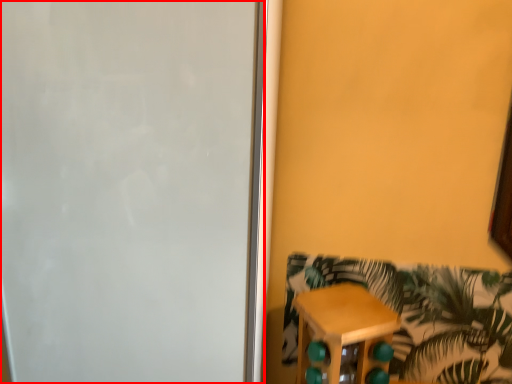
Question: From the image's perspective, what is the correct spatial relationship of screen door (annotated by the red box) in relation to furniture?

Choices:
 (A) below
 (B) above

Answer: (B)